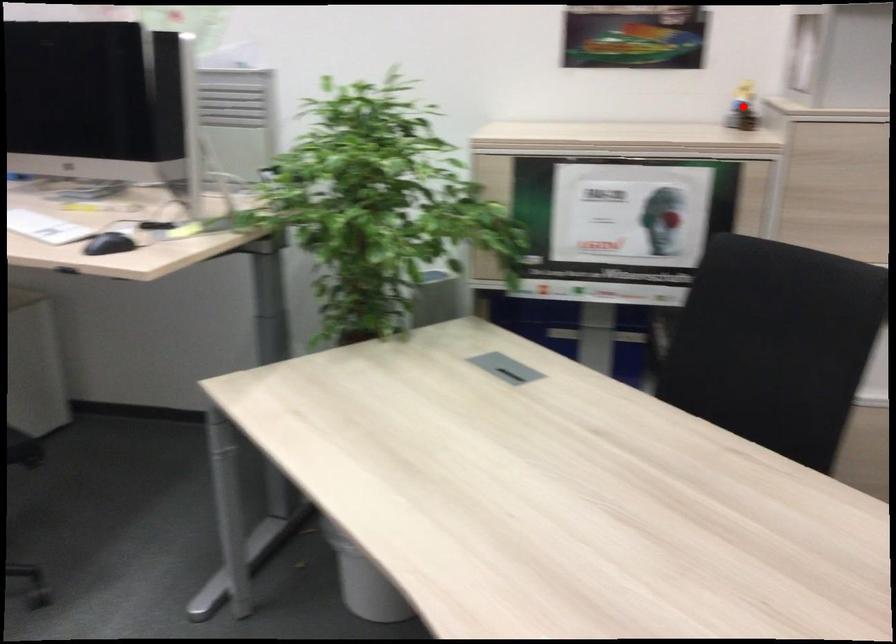
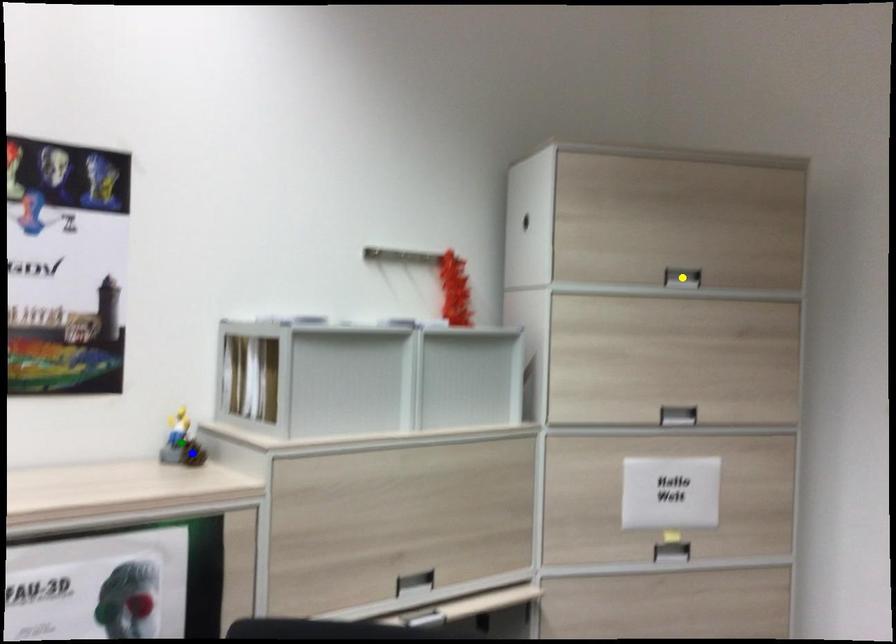
Question: I am providing you with two images of the same scene from different viewpoints. A red point is marked on the first image. You are given multiple points on the second image. In image 2, which mark is for the same physical point as the one in image 1?

Choices:
 (A) blue point
 (B) yellow point
 (C) green point

Answer: (C)